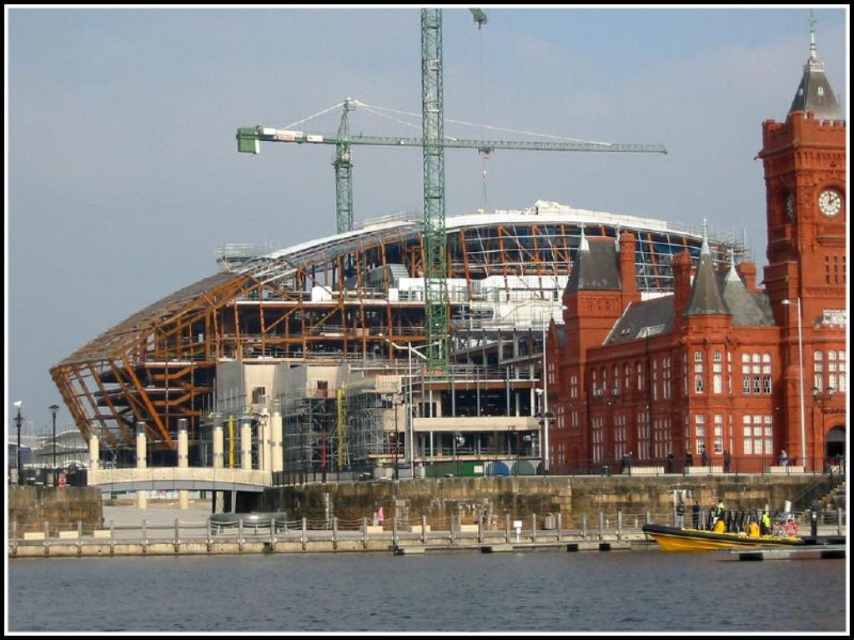
You are a construction worker standing at the base of the red brick clock tower at upper right. You need to pour water from a bucket onto the ground below. Where will the transparent water at lower center end up?

The transparent water at lower center will end up below the red brick clock tower at upper right since it is located there.

You are an architect standing between the green metal crane at center and the yellow rubber boat at lower center. Which object would appear closer to you based on their positions in the image?

The green metal crane at center is closer to you because it is further to the viewer than the yellow rubber boat at lower center, meaning it occupies a more foreground position in the visual plane.